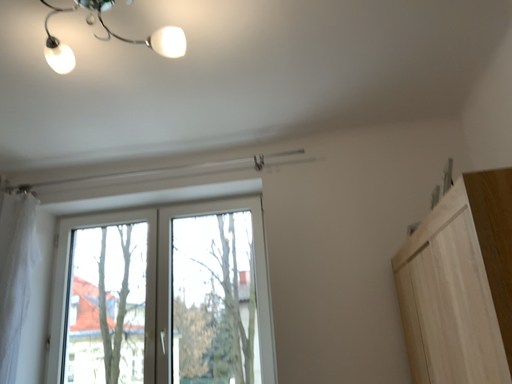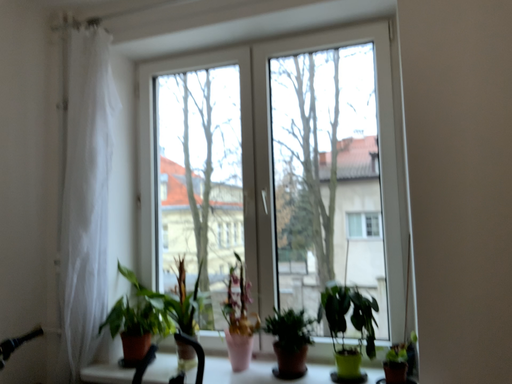
Question: How did the camera likely rotate when shooting the video?

Choices:
 (A) rotated upward
 (B) rotated downward

Answer: (B)